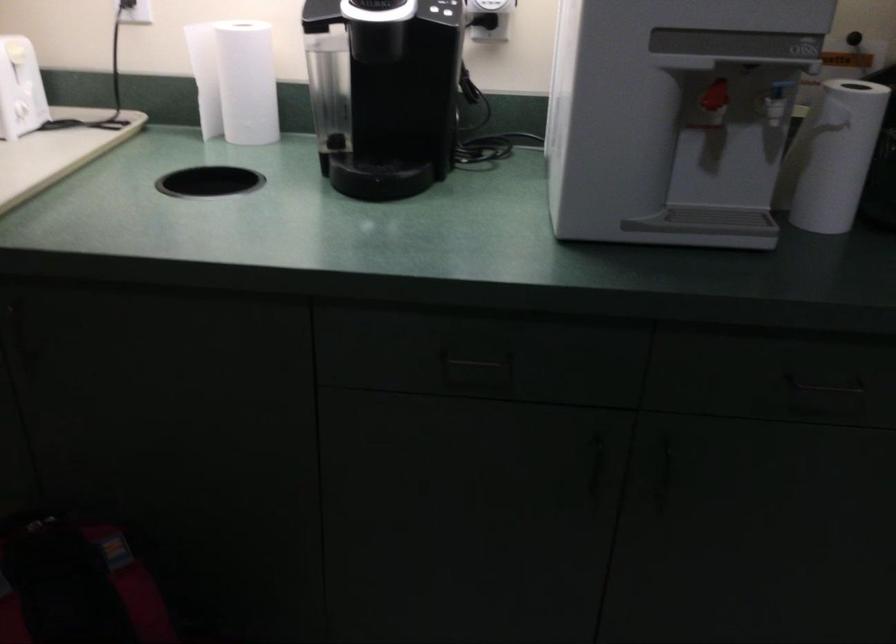
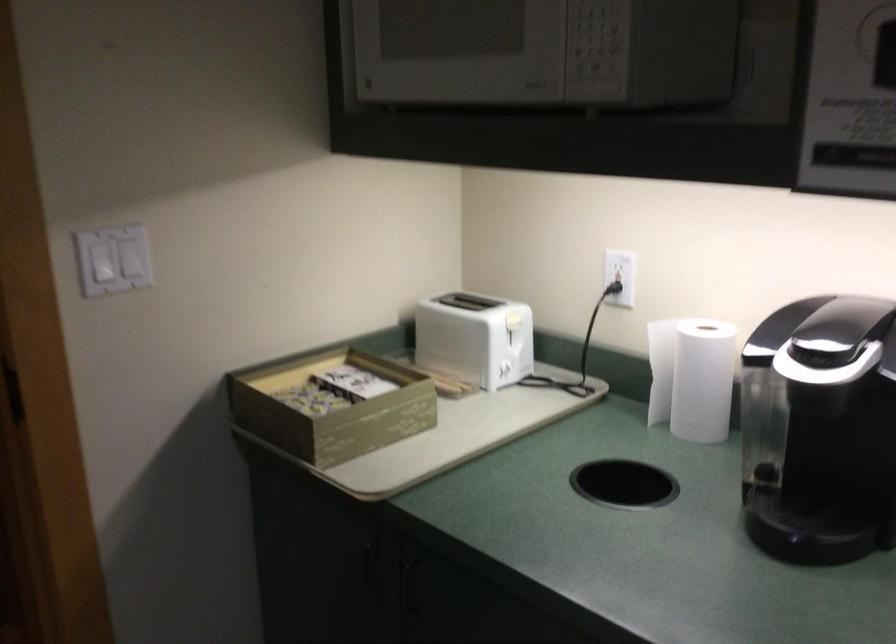
Locate, in the second image, the point that corresponds to pixel 398 105 in the first image.

(839, 458)